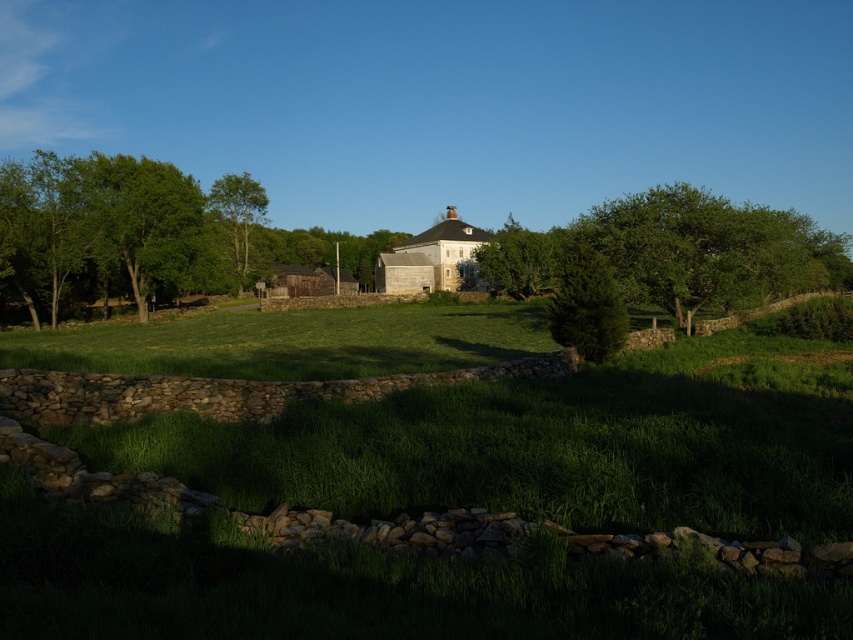
You are standing in the field and want to walk to both the point at coordinates (373, 241) and the point at coordinates (229, 225). Which point will you reach first?

You will reach the point at coordinates (229, 225) first because it is closer to you than the point at coordinates (373, 241), which is further away.